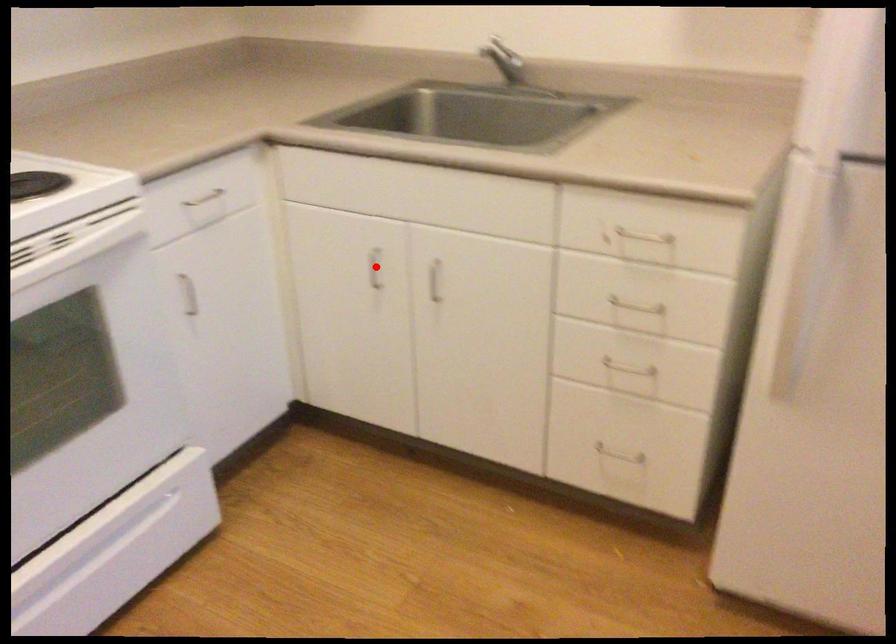
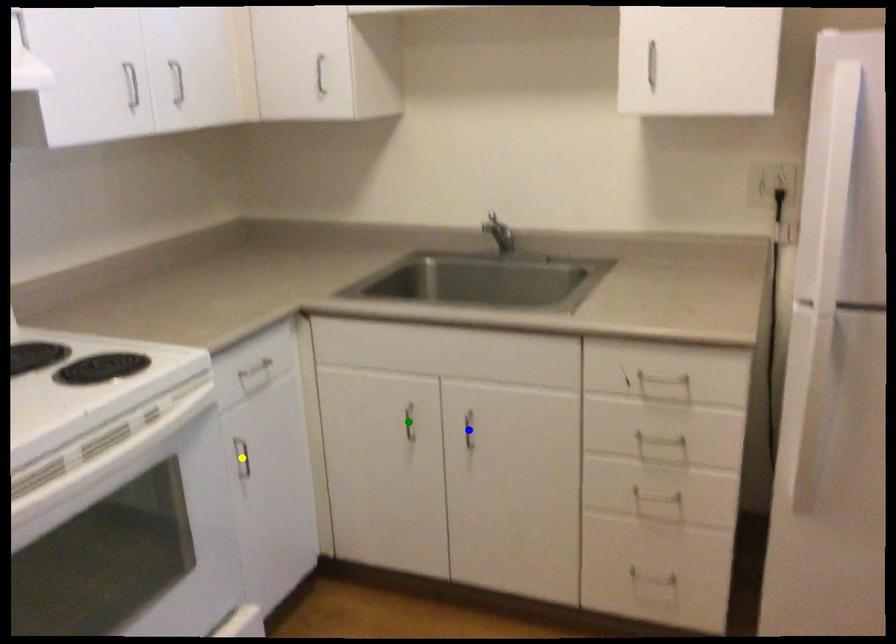
Question: I am providing you with two images of the same scene from different viewpoints. A red point is marked on the first image. You are given multiple points on the second image. In image 2, which mark is for the same physical point as the one in image 1?

Choices:
 (A) green point
 (B) blue point
 (C) yellow point

Answer: (A)